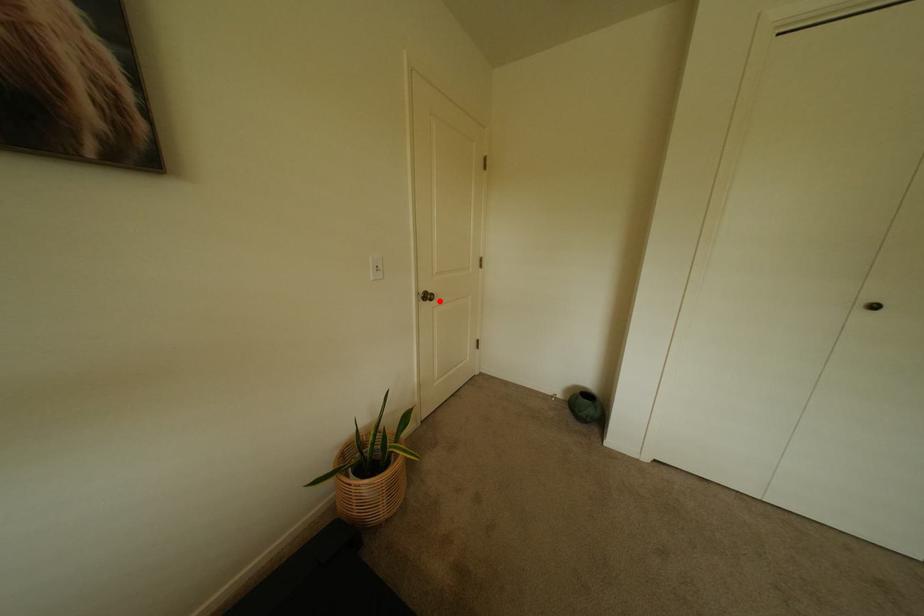
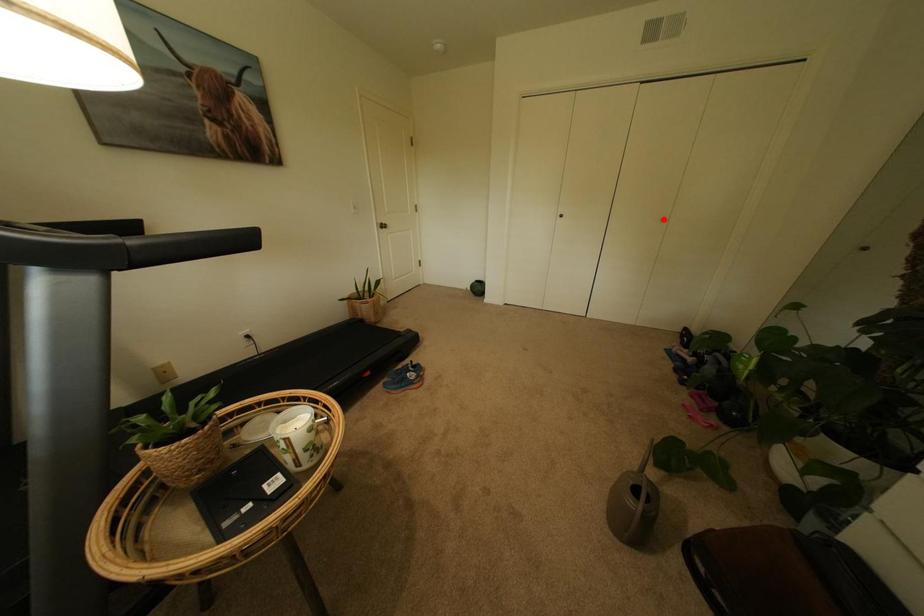
I am providing you with two images of the same scene from different viewpoints. A red point is marked on the first image and another point is marked on the second image. Is the red point in image1 aligned with the point shown in image2?

No